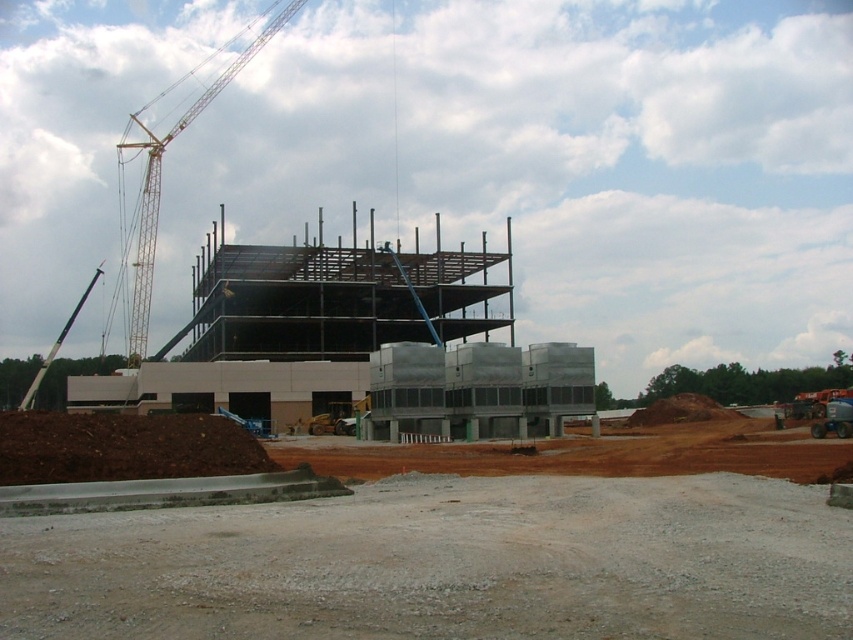
You are a construction worker standing at the point labeled as point (x=160, y=182). You need to move towards the partially constructed building in the midground. Which direction should you face to walk directly towards the building?

You should face towards the right direction from point (x=160, y=182) to walk directly towards the partially constructed building in the midground.